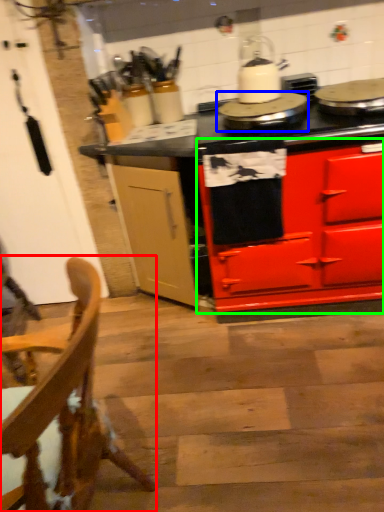
Question: Which object is positioned farthest from chair (highlighted by a red box)? Select from appliance (highlighted by a blue box) and cabinetry (highlighted by a green box).

Choices:
 (A) appliance
 (B) cabinetry

Answer: (A)